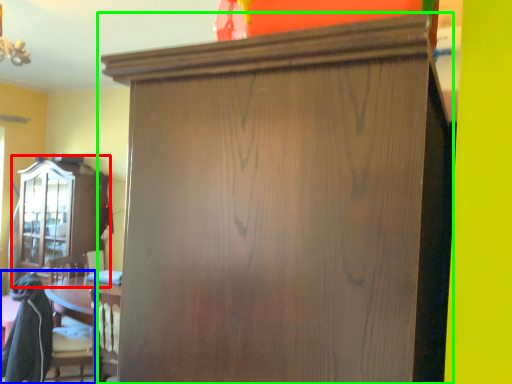
Question: Estimate the real-world distances between objects in this image. Which object is farther from cabinetry (highlighted by a red box), swivel chair (highlighted by a blue box) or cupboard (highlighted by a green box)?

Choices:
 (A) swivel chair
 (B) cupboard

Answer: (B)